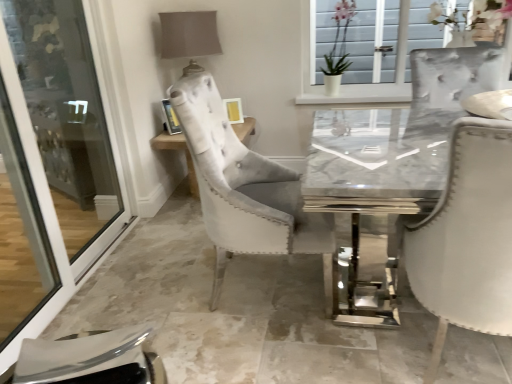
Question: Can you confirm if transparent glass screen door at left is taller than metallic silver picture frame at upper center?

Choices:
 (A) yes
 (B) no

Answer: (A)

Question: Considering the relative sizes of transparent glass screen door at left and metallic silver picture frame at upper center in the image provided, is transparent glass screen door at left smaller than metallic silver picture frame at upper center?

Choices:
 (A) yes
 (B) no

Answer: (B)

Question: From a real-world perspective, is transparent glass screen door at left on metallic silver picture frame at upper center?

Choices:
 (A) yes
 (B) no

Answer: (A)

Question: From the image's perspective, is transparent glass screen door at left over metallic silver picture frame at upper center?

Choices:
 (A) yes
 (B) no

Answer: (B)

Question: Is transparent glass screen door at left at the right side of metallic silver picture frame at upper center?

Choices:
 (A) no
 (B) yes

Answer: (A)

Question: Is metallic silver picture frame at upper center spatially inside transparent glass screen door at left, or outside of it?

Choices:
 (A) outside
 (B) inside

Answer: (A)

Question: Does point (177, 125) appear closer or farther from the camera than point (30, 228)?

Choices:
 (A) closer
 (B) farther

Answer: (B)

Question: Is metallic silver picture frame at upper center in front of or behind transparent glass screen door at left in the image?

Choices:
 (A) behind
 (B) front

Answer: (A)

Question: In terms of width, does metallic silver picture frame at upper center look wider or thinner when compared to transparent glass screen door at left?

Choices:
 (A) wide
 (B) thin

Answer: (A)

Question: Considering the positions of transparent glass screen door at left and white glossy vase at upper center in the image, is transparent glass screen door at left wider or thinner than white glossy vase at upper center?

Choices:
 (A) wide
 (B) thin

Answer: (B)

Question: Is transparent glass screen door at left in front of or behind white glossy vase at upper center in the image?

Choices:
 (A) behind
 (B) front

Answer: (B)

Question: From their relative heights in the image, would you say transparent glass screen door at left is taller or shorter than white glossy vase at upper center?

Choices:
 (A) short
 (B) tall

Answer: (B)

Question: Which is correct: transparent glass screen door at left is inside white glossy vase at upper center, or outside of it?

Choices:
 (A) outside
 (B) inside

Answer: (A)

Question: Is white glossy vase at upper center situated inside transparent glass screen door at left or outside?

Choices:
 (A) inside
 (B) outside

Answer: (B)

Question: In terms of width, does white glossy vase at upper center look wider or thinner when compared to transparent glass screen door at left?

Choices:
 (A) wide
 (B) thin

Answer: (A)